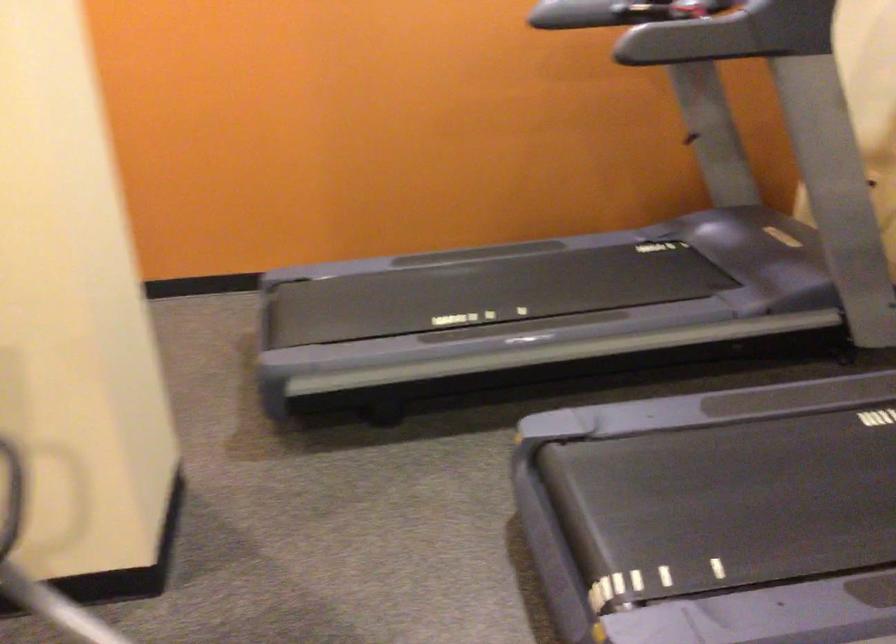
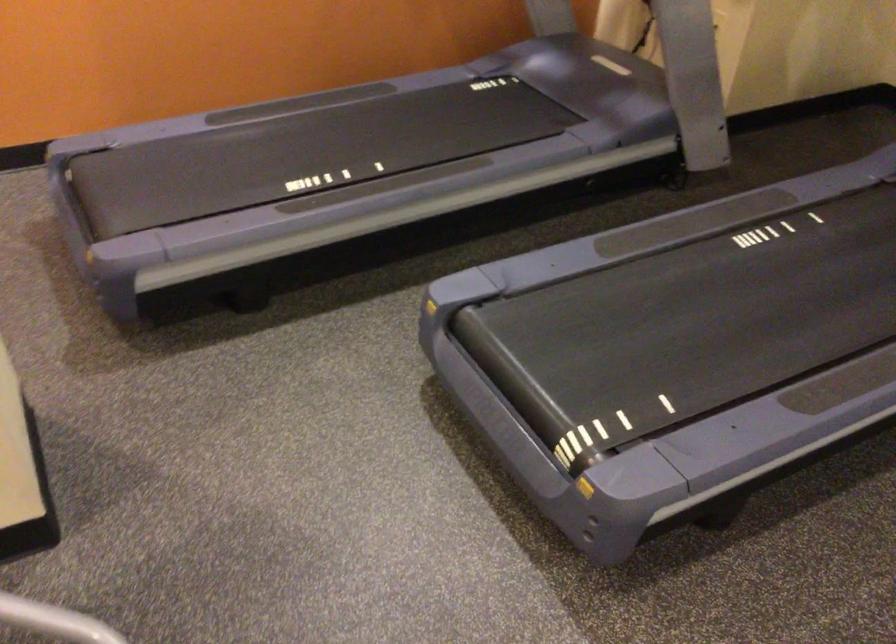
In the second image, find the point that corresponds to the point at 474,252 in the first image.

(294, 104)